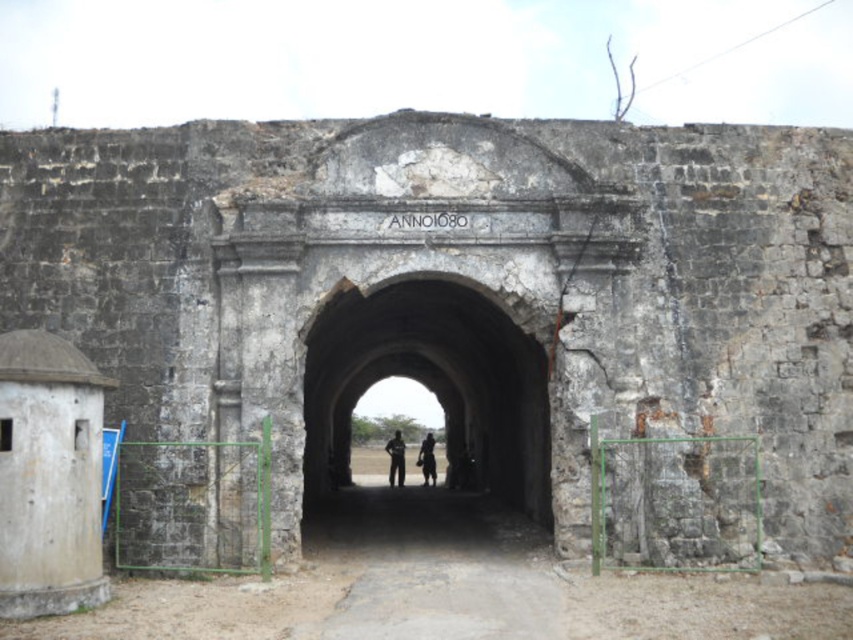
You are a tour guide leading a group through the historical site. You want to ensure everyone stays within the safe zone marked by the 20 meter boundary. Are the rusty stone tunnel at center and dark skin textured person at center within the safe zone?

The distance between the rusty stone tunnel at center and dark skin textured person at center is 21.79 meters, which exceeds the 20 meter boundary. Therefore, they are outside the safe zone.

You are standing outside the ancient stone archway and want to enter the rusty stone tunnel at center. The black matte person at center is already inside. Can you pass through the tunnel without squeezing?

The rusty stone tunnel at center is wider than the black matte person at center, so yes, you can pass through the tunnel without squeezing.

You are a tour guide leading a group through a historical site. You notice two visitors, a black matte person at center and a dark skin textured person at center, standing in the ancient stone archway. The archway has a height of 12 feet. Can both visitors safely pass through the archway without touching their heads?

The black matte person at center and dark skin textured person at center are 13.34 feet apart. Since the archway is 12 feet tall, visitors over 12 feet in height would risk touching their heads. However, the average human height is around 5.5 feet, so both visitors can safely pass through without touching their heads.